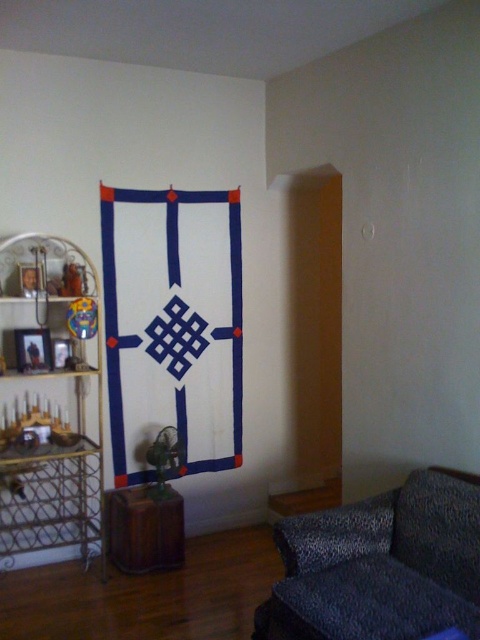
Question: Where is leopard print fabric couch at lower right located in relation to metallic gold shelving unit at left in the image?

Choices:
 (A) left
 (B) right

Answer: (B)

Question: Can you confirm if leopard print fabric couch at lower right is positioned above metallic gold shelving unit at left?

Choices:
 (A) no
 (B) yes

Answer: (A)

Question: Which of the following is the farthest from the observer?

Choices:
 (A) (40, 502)
 (B) (143, 572)
 (C) (434, 529)

Answer: (A)

Question: Which object is the closest to the metallic gold shelving unit at left?

Choices:
 (A) leopard print fabric couch at lower right
 (B) brown wooden stool at lower left

Answer: (B)

Question: Which object appears closest to the camera in this image?

Choices:
 (A) leopard print fabric couch at lower right
 (B) brown wooden stool at lower left

Answer: (A)

Question: Does metallic gold shelving unit at left have a smaller size compared to brown wooden stool at lower left?

Choices:
 (A) yes
 (B) no

Answer: (B)